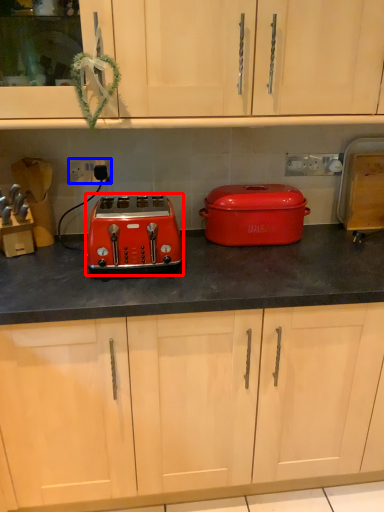
Question: Which point is further to the camera, toaster (highlighted by a red box) or electric outlet (highlighted by a blue box)?

Choices:
 (A) toaster
 (B) electric outlet

Answer: (B)